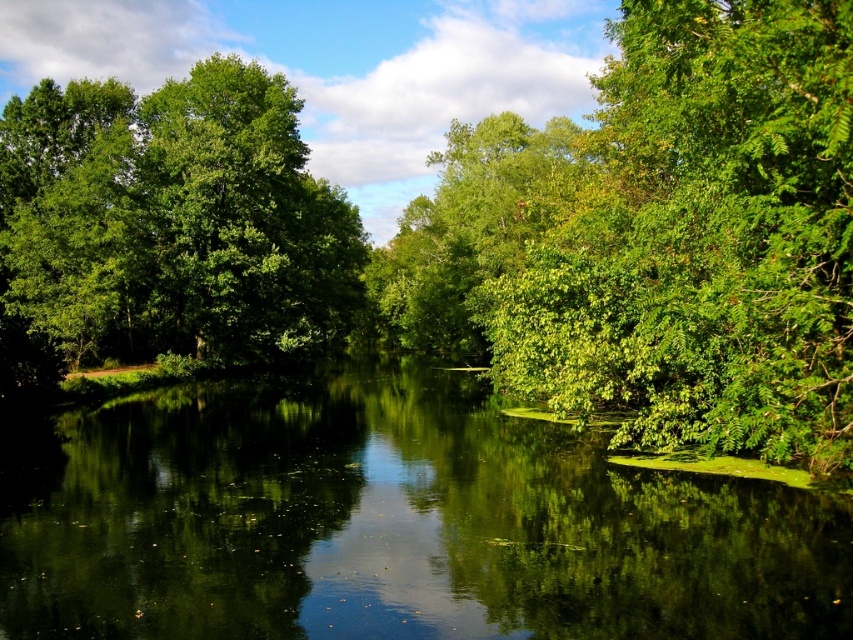
Question: Is green leafy forest at center to the right of green reflective water at center from the viewer's perspective?

Choices:
 (A) no
 (B) yes

Answer: (B)

Question: Can you confirm if green reflective water at center is positioned to the right of green leafy tree at upper right?

Choices:
 (A) no
 (B) yes

Answer: (A)

Question: Can you confirm if green leafy tree at upper right is positioned below green leafy tree at left?

Choices:
 (A) no
 (B) yes

Answer: (B)

Question: Among these points, which one is nearest to the camera?

Choices:
 (A) (410, 243)
 (B) (688, 593)
 (C) (422, 218)

Answer: (B)

Question: Which point is closer to the camera?

Choices:
 (A) green leafy tree at center
 (B) green leafy forest at center

Answer: (B)

Question: Which point is farther to the camera?

Choices:
 (A) (780, 172)
 (B) (279, 124)

Answer: (B)